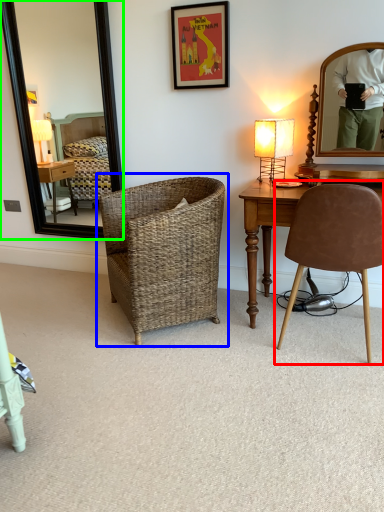
Question: Based on their relative distances, which object is nearer to chair (highlighted by a red box)? Choose from chair (highlighted by a blue box) and mirror (highlighted by a green box).

Choices:
 (A) chair
 (B) mirror

Answer: (A)